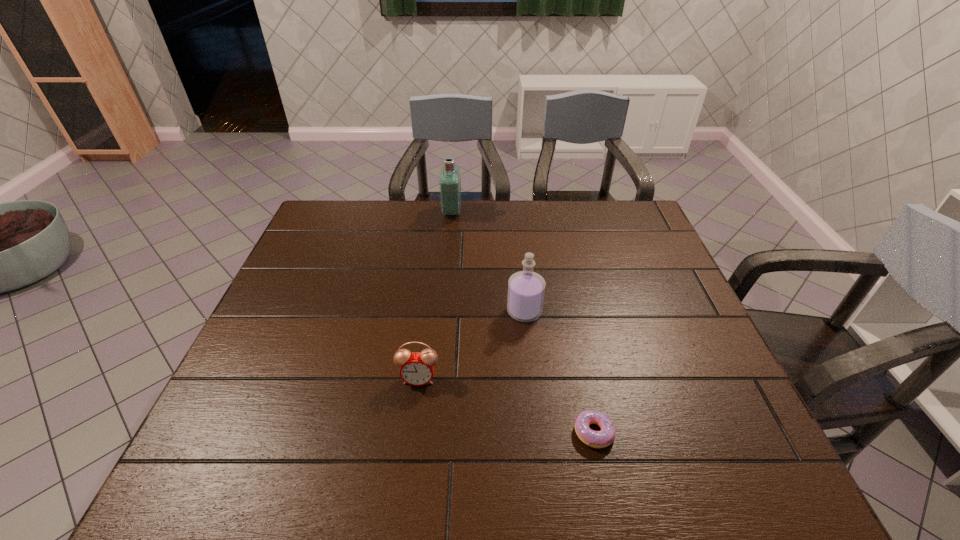
Where is `free space that is in between the left perfume and the third tallest object`? This screenshot has width=960, height=540. free space that is in between the left perfume and the third tallest object is located at coordinates (435, 295).

In order to click on free space between the third object from left to right and the left perfume in this screenshot , I will do `click(488, 261)`.

I want to click on free space between the third tallest object and the farther perfume, so click(435, 295).

Locate an element on the screen. This screenshot has width=960, height=540. free spot between the third object from left to right and the rightmost object is located at coordinates (560, 372).

The width and height of the screenshot is (960, 540). Identify the location of free space between the third tallest object and the farthest object. (435, 295).

You are a GUI agent. You are given a task and a screenshot of the screen. Output one action in this format:
    pyautogui.click(x=<x>, y=<y>)
    Task: Click on the empty space between the nearest object and the third tallest object
    This screenshot has width=960, height=540.
    Given the screenshot: What is the action you would take?
    pyautogui.click(x=506, y=406)

This screenshot has width=960, height=540. Identify the location of vacant area between the alarm clock and the rightmost object. (506, 406).

This screenshot has height=540, width=960. What are the coordinates of `blank region between the farthest object and the third nearest object` in the screenshot? It's located at (488, 261).

At what (x,y) coordinates should I click in order to perform the action: click on free space between the nearest object and the second nearest object. Please return your answer as a coordinate pair (x, y). Looking at the image, I should click on (506, 406).

Locate an element on the screen. object that is the second nearest to the farthest object is located at coordinates (417, 368).